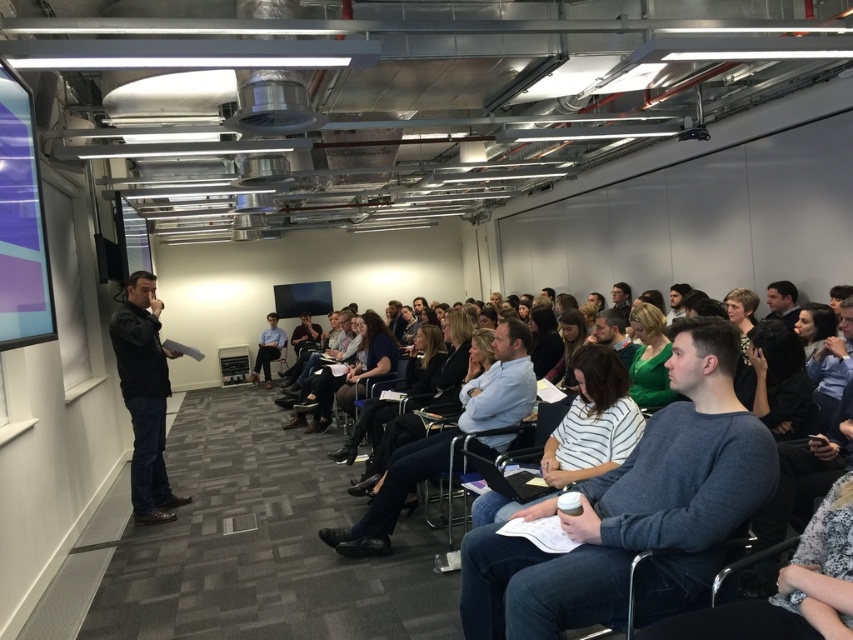
Does light blue shirt at center appear under black fabric at center?

Yes.

Does light blue shirt at center appear on the right side of black fabric at center?

Incorrect, light blue shirt at center is not on the right side of black fabric at center.

Describe the element at coordinates (445, 440) in the screenshot. I see `light blue shirt at center` at that location.

The height and width of the screenshot is (640, 853). Find the location of `light blue shirt at center`. light blue shirt at center is located at coordinates (445, 440).

Is matte purple projection screen at left to the right of dark brown hair at center from the viewer's perspective?

No, matte purple projection screen at left is not to the right of dark brown hair at center.

Who is more forward, (1,328) or (554,378)?

Point (1,328)

Does point (9, 275) come behind point (558, 371)?

No, it is not.

Find the location of a particular element. matte purple projection screen at left is located at coordinates (21, 224).

Is blue sweater at center wider than light blue shirt at center?

No.

Is point (664, 428) positioned behind point (389, 497)?

No, it is not.

This screenshot has height=640, width=853. In order to click on blue sweater at center in this screenshot , I will do `click(636, 513)`.